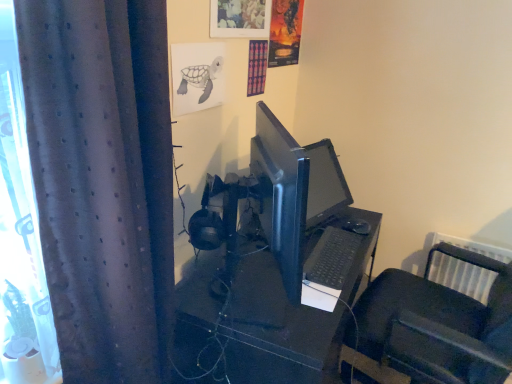
Where is `vacant area situated below black matte keyboard at center (from a real-world perspective)`? This screenshot has height=384, width=512. vacant area situated below black matte keyboard at center (from a real-world perspective) is located at coordinates (326, 254).